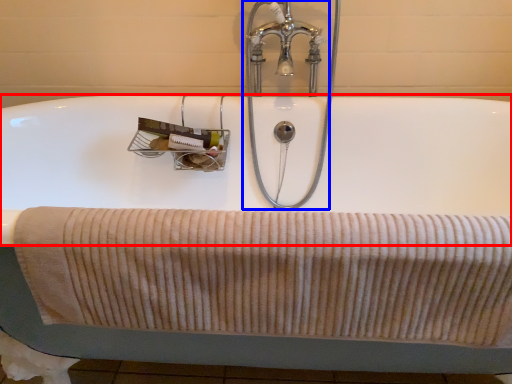
Question: Which point is closer to the camera, bath (highlighted by a red box) or tap (highlighted by a blue box)?

Choices:
 (A) bath
 (B) tap

Answer: (A)